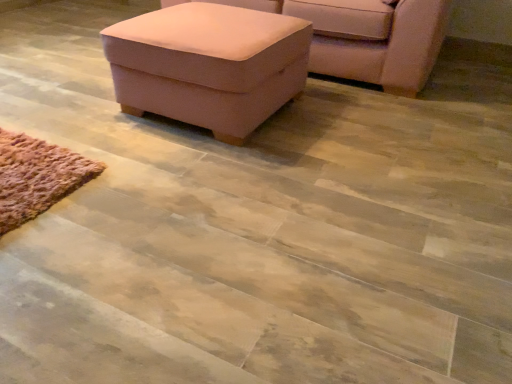
Question: Relative to pink fabric ottoman at upper center, is suede-like pink ottoman at upper center in front or behind?

Choices:
 (A) front
 (B) behind

Answer: (B)

Question: Considering the positions of point 343,44 and point 245,92, is point 343,44 closer or farther from the camera than point 245,92?

Choices:
 (A) farther
 (B) closer

Answer: (A)

Question: Do you think suede-like pink ottoman at upper center is within pink fabric ottoman at upper center, or outside of it?

Choices:
 (A) inside
 (B) outside

Answer: (B)

Question: Considering the positions of pink fabric ottoman at upper center and suede-like pink ottoman at upper center in the image, is pink fabric ottoman at upper center taller or shorter than suede-like pink ottoman at upper center?

Choices:
 (A) short
 (B) tall

Answer: (A)

Question: Considering the positions of point (120, 81) and point (430, 54), is point (120, 81) closer or farther from the camera than point (430, 54)?

Choices:
 (A) closer
 (B) farther

Answer: (A)

Question: Considering their positions, is pink fabric ottoman at upper center located in front of or behind suede-like pink ottoman at upper center?

Choices:
 (A) behind
 (B) front

Answer: (B)

Question: In terms of width, does pink fabric ottoman at upper center look wider or thinner when compared to suede-like pink ottoman at upper center?

Choices:
 (A) thin
 (B) wide

Answer: (A)